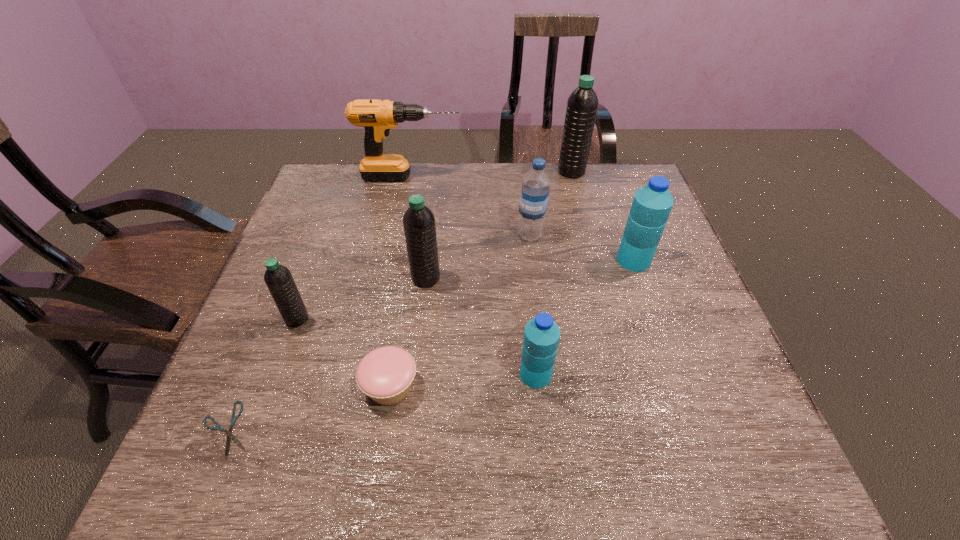
At what (x,y) coordinates should I click in order to perform the action: click on object present at the near edge. Please return your answer as a coordinate pair (x, y). The image size is (960, 540). Looking at the image, I should click on (230, 436).

You are a GUI agent. You are given a task and a screenshot of the screen. Output one action in this format:
    pyautogui.click(x=<x>, y=<y>)
    Task: Click on the drill located at the left edge
    This screenshot has height=540, width=960.
    Given the screenshot: What is the action you would take?
    pyautogui.click(x=377, y=117)

Where is `water bottle that is positioned at the left edge`? The image size is (960, 540). water bottle that is positioned at the left edge is located at coordinates (278, 278).

Identify the location of shears that is at the left edge. The image size is (960, 540). (230, 436).

Identify the location of object situated at the right edge. The width and height of the screenshot is (960, 540). coord(652,204).

Identify the location of object present at the far left corner. (377, 117).

Find the location of a particular element. This screenshot has width=960, height=540. object located at the near left corner is located at coordinates pyautogui.click(x=230, y=436).

Where is `free space at the far edge of the desktop`? This screenshot has height=540, width=960. free space at the far edge of the desktop is located at coordinates (571, 187).

Find the location of a particular element. This screenshot has width=960, height=540. vacant position at the left edge of the desktop is located at coordinates (294, 395).

The width and height of the screenshot is (960, 540). In order to click on vacant area at the right edge in this screenshot , I will do `click(687, 407)`.